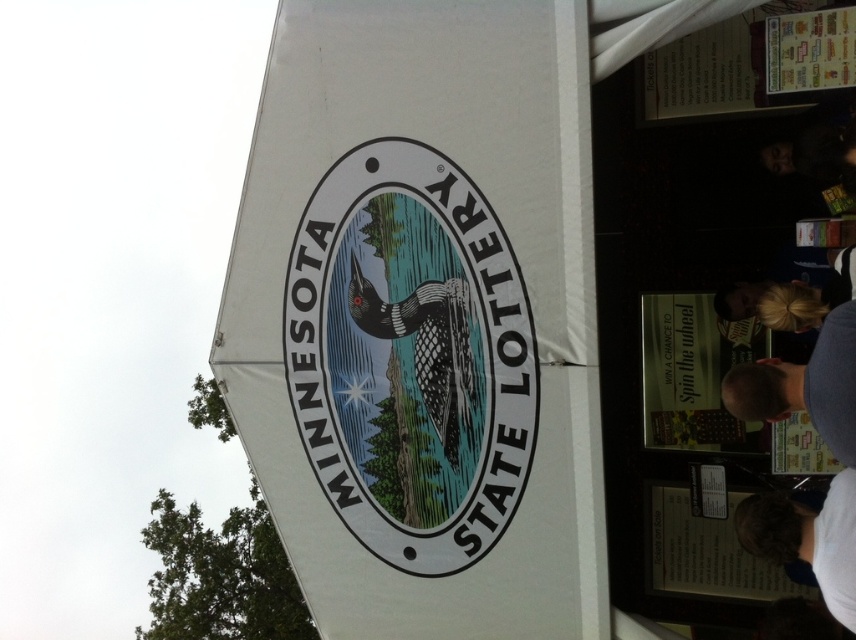
You are standing at the entrance of the tent and want to locate the white fabric canopy at center. According to the coordinates provided, where should you look?

You should look at point (423, 317) to find the white fabric canopy at center.

You are standing at the origin point of the coordinate system. You want to walk towards the white fabric canopy at center. In which direction should you walk?

The white fabric canopy at center is located at point (x=423, y=317), so you should walk in the direction of the coordinates increasing in both x and y axes from the origin.

You are a photographer trying to capture a clear photo of the Minnesota State Lottery logo on the tent. However, there is a person wearing a blue shirt at right blocking your view. Can you still see the logo clearly through the white fabric canopy at center?

The blue shirt at right is behind the white fabric canopy at center, so the logo on the canopy should still be visible as the shirt is not in front of it.